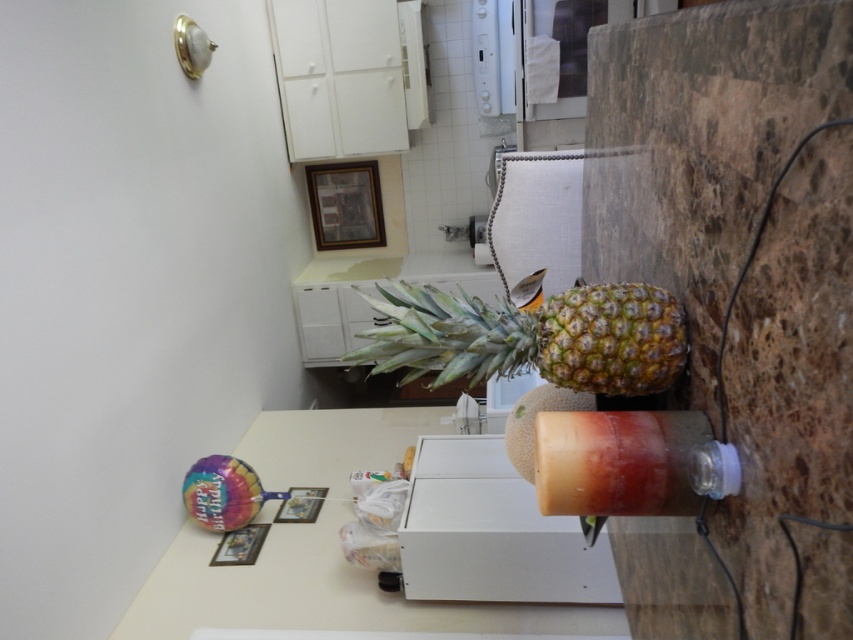
Does white matte table at center appear on the right side of translucent plastic bottle at lower right?

No, white matte table at center is not to the right of translucent plastic bottle at lower right.

Consider the image. Which of these two, white matte table at center or translucent plastic bottle at lower right, stands shorter?

translucent plastic bottle at lower right

The image size is (853, 640). What are the coordinates of `white matte table at center` in the screenshot? It's located at (323, 547).

Where is `white matte table at center`? Image resolution: width=853 pixels, height=640 pixels. white matte table at center is located at coordinates (323, 547).

Does yellow-green textured pineapple at center appear over translucent plastic bottle at lower right?

Correct, yellow-green textured pineapple at center is located above translucent plastic bottle at lower right.

Is yellow-green textured pineapple at center below translucent plastic bottle at lower right?

Incorrect, yellow-green textured pineapple at center is not positioned below translucent plastic bottle at lower right.

Is point (505, 349) behind point (701, 484)?

Yes, it is.

I want to click on yellow-green textured pineapple at center, so click(532, 337).

Does white matte table at center appear on the right side of yellow-green textured pineapple at center?

In fact, white matte table at center is to the left of yellow-green textured pineapple at center.

Does white matte table at center have a lesser width compared to yellow-green textured pineapple at center?

No.

Which is in front, point (198, 593) or point (611, 340)?

Point (611, 340) is in front.

This screenshot has width=853, height=640. What are the coordinates of `white matte table at center` in the screenshot? It's located at (323, 547).